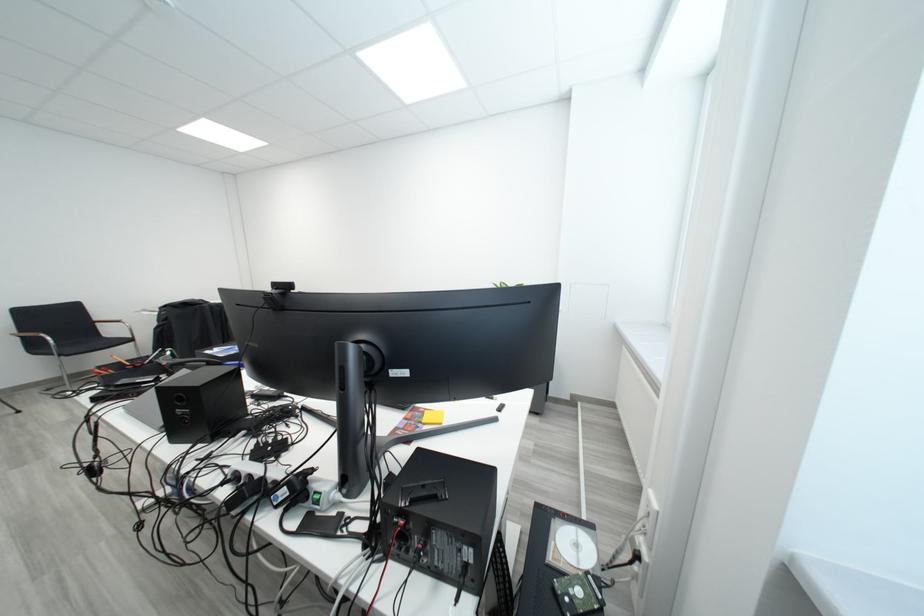
The image size is (924, 616). What do you see at coordinates (185, 415) in the screenshot?
I see `the black speaker knob` at bounding box center [185, 415].